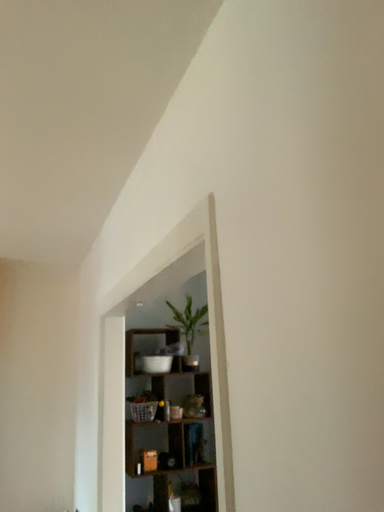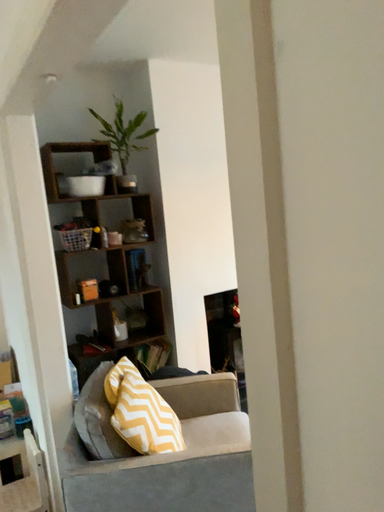
Question: Which way did the camera rotate in the video?

Choices:
 (A) rotated downward
 (B) rotated upward

Answer: (A)